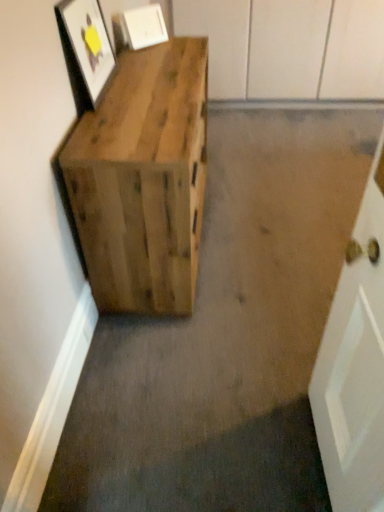
Question: Considering the relative positions of matte white picture frame at upper center, placed as the 2th picture frame when sorted from front to back, and matte wooden picture frame at upper left, which is the 2th picture frame in back-to-front order, in the image provided, is matte white picture frame at upper center, placed as the 2th picture frame when sorted from front to back, to the right of matte wooden picture frame at upper left, which is the 2th picture frame in back-to-front order, from the viewer's perspective?

Choices:
 (A) yes
 (B) no

Answer: (A)

Question: Is matte white picture frame at upper center, the first picture frame viewed from the back, next to matte wooden picture frame at upper left, positioned as the first picture frame in front-to-back order?

Choices:
 (A) yes
 (B) no

Answer: (B)

Question: Is matte white picture frame at upper center, placed as the 2th picture frame when sorted from front to back, wider than matte wooden picture frame at upper left, which is the 2th picture frame in back-to-front order?

Choices:
 (A) no
 (B) yes

Answer: (B)

Question: Does matte white picture frame at upper center, the first picture frame viewed from the back, have a larger size compared to matte wooden picture frame at upper left, positioned as the first picture frame in front-to-back order?

Choices:
 (A) yes
 (B) no

Answer: (B)

Question: Considering the relative sizes of matte white picture frame at upper center, placed as the 2th picture frame when sorted from front to back, and matte wooden picture frame at upper left, positioned as the first picture frame in front-to-back order, in the image provided, is matte white picture frame at upper center, placed as the 2th picture frame when sorted from front to back, shorter than matte wooden picture frame at upper left, positioned as the first picture frame in front-to-back order,?

Choices:
 (A) yes
 (B) no

Answer: (A)

Question: From a real-world perspective, is matte white picture frame at upper center, the first picture frame viewed from the back, above or below matte wooden picture frame at upper left, positioned as the first picture frame in front-to-back order?

Choices:
 (A) above
 (B) below

Answer: (B)

Question: Is matte white picture frame at upper center, the first picture frame viewed from the back, wider or thinner than matte wooden picture frame at upper left, which is the 2th picture frame in back-to-front order?

Choices:
 (A) wide
 (B) thin

Answer: (A)

Question: Considering the positions of matte white picture frame at upper center, the first picture frame viewed from the back, and matte wooden picture frame at upper left, positioned as the first picture frame in front-to-back order, in the image, is matte white picture frame at upper center, the first picture frame viewed from the back, bigger or smaller than matte wooden picture frame at upper left, positioned as the first picture frame in front-to-back order,?

Choices:
 (A) small
 (B) big

Answer: (A)

Question: Is matte white picture frame at upper center, the first picture frame viewed from the back, taller or shorter than matte wooden picture frame at upper left, which is the 2th picture frame in back-to-front order?

Choices:
 (A) tall
 (B) short

Answer: (B)

Question: From the image's perspective, is matte white picture frame at upper center, the first picture frame viewed from the back, above or below natural wood crate at left?

Choices:
 (A) above
 (B) below

Answer: (A)

Question: From a real-world perspective, is matte white picture frame at upper center, placed as the 2th picture frame when sorted from front to back, physically located above or below natural wood crate at left?

Choices:
 (A) below
 (B) above

Answer: (B)

Question: In terms of width, does matte white picture frame at upper center, placed as the 2th picture frame when sorted from front to back, look wider or thinner when compared to natural wood crate at left?

Choices:
 (A) thin
 (B) wide

Answer: (A)

Question: In the image, is matte white picture frame at upper center, the first picture frame viewed from the back, on the left side or the right side of natural wood crate at left?

Choices:
 (A) left
 (B) right

Answer: (A)

Question: Do you think matte wooden picture frame at upper left, which is the 2th picture frame in back-to-front order, is within natural wood crate at left, or outside of it?

Choices:
 (A) outside
 (B) inside

Answer: (A)

Question: From a real-world perspective, is matte wooden picture frame at upper left, positioned as the first picture frame in front-to-back order, physically located above or below natural wood crate at left?

Choices:
 (A) above
 (B) below

Answer: (A)